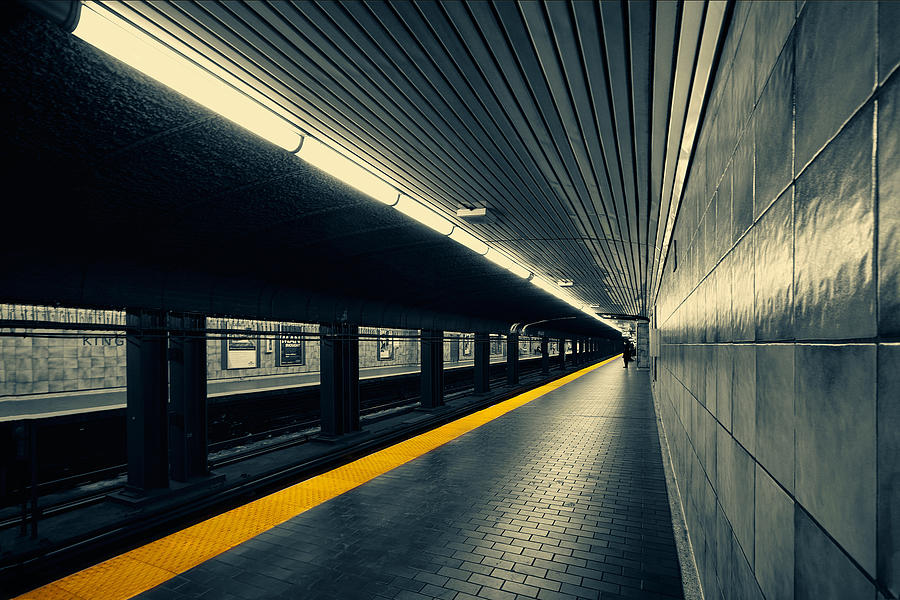
Where is `rectangular pillars`? The width and height of the screenshot is (900, 600). rectangular pillars is located at coordinates (615, 351), (558, 358), (523, 328), (481, 365), (457, 375), (375, 415), (191, 423).